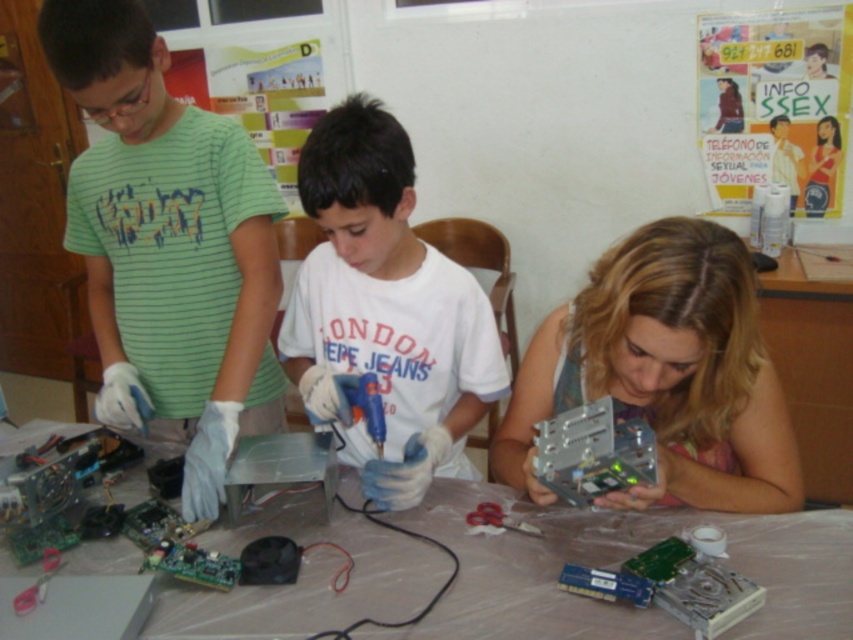
You are a photographer in a classroom setting. You need to take a photo of the green striped shirt at left and the metallic gray electronic device at lower right. Which object will appear larger in the photo?

The green striped shirt at left will appear larger in the photo because it is bigger than the metallic gray electronic device at lower right.

Based on the scene described, which object is positioned higher when looking at the metallic gray electronic device at lower right and the metallic circuit board at lower right?

The metallic gray electronic device at lower right is positioned higher than the metallic circuit board at lower right.